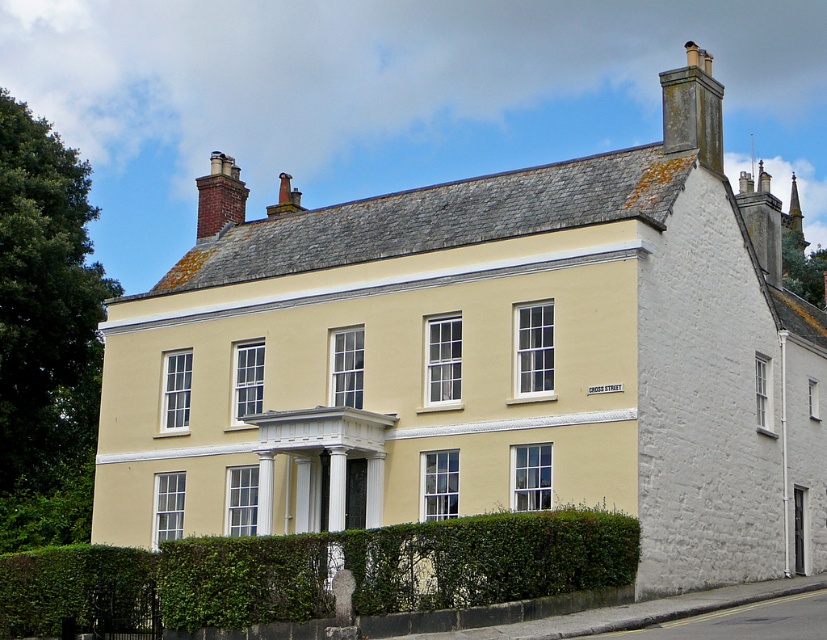
Looking at this image, you are a gardener planning to trim the green leafy hedge at lower center and the white stone chimney at upper right. Which object requires a ladder to reach its top?

The white stone chimney at upper right requires a ladder to reach its top since it is taller than the green leafy hedge at lower center.

You are a delivery person trying to locate the correct chimney for installing a new satellite dish. The satellite dish requires a clear view and must be placed on the chimney that is positioned to the right of the other. Which chimney should you choose between the dark gray stone chimney at upper right and the white stone chimney at upper right?

The white stone chimney at upper right is positioned to the right of the dark gray stone chimney at upper right, so you should choose the white stone chimney at upper right for installing the satellite dish to ensure it has the required clear view.